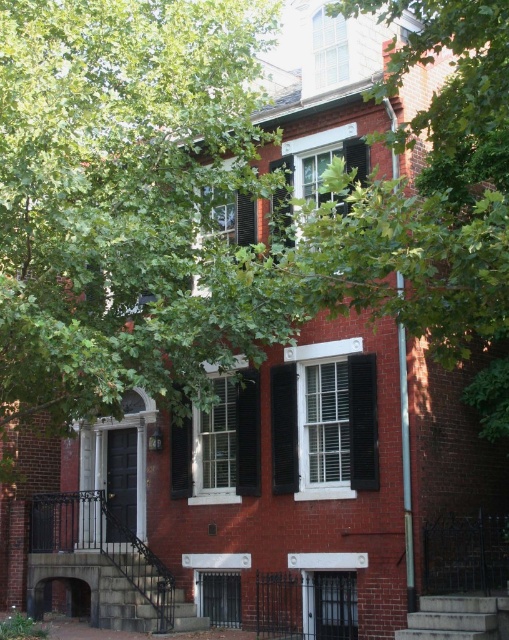
Is matte black shutters at center taller than black wrought iron stairs at lower left?

Incorrect, matte black shutters at center's height is not larger of black wrought iron stairs at lower left's.

Identify the location of matte black shutters at center. (220, 442).

This screenshot has height=640, width=509. Find the location of `matte black shutters at center`. matte black shutters at center is located at coordinates (220, 442).

Does black matte shutters at center have a lesser width compared to matte black shutters at center?

Indeed, black matte shutters at center has a lesser width compared to matte black shutters at center.

Measure the distance between point (321, 424) and camera.

Point (321, 424) is 132.06 feet away from camera.

Who is more distant from viewer, (275, 474) or (216, 380)?

Point (216, 380)

Locate an element on the screen. This screenshot has height=640, width=509. black matte shutters at center is located at coordinates (343, 420).

Which of these two, matte black shutters at center or concrete stairs at lower right, stands shorter?

With less height is matte black shutters at center.

Between point (240, 433) and point (437, 621), which one is positioned behind?

Positioned behind is point (240, 433).

Does point (239, 458) come in front of point (408, 612)?

That is False.

Locate an element on the screen. matte black shutters at center is located at coordinates (220, 442).